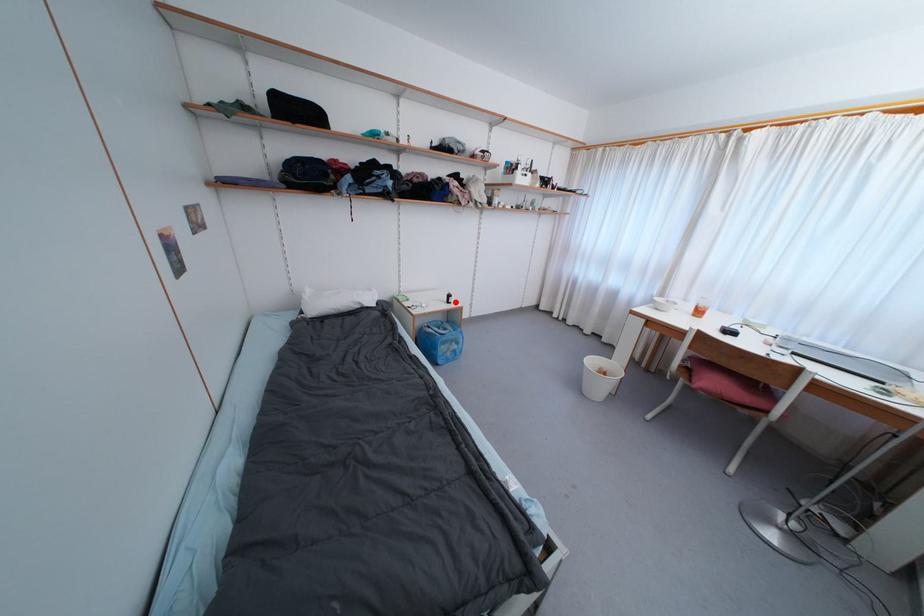
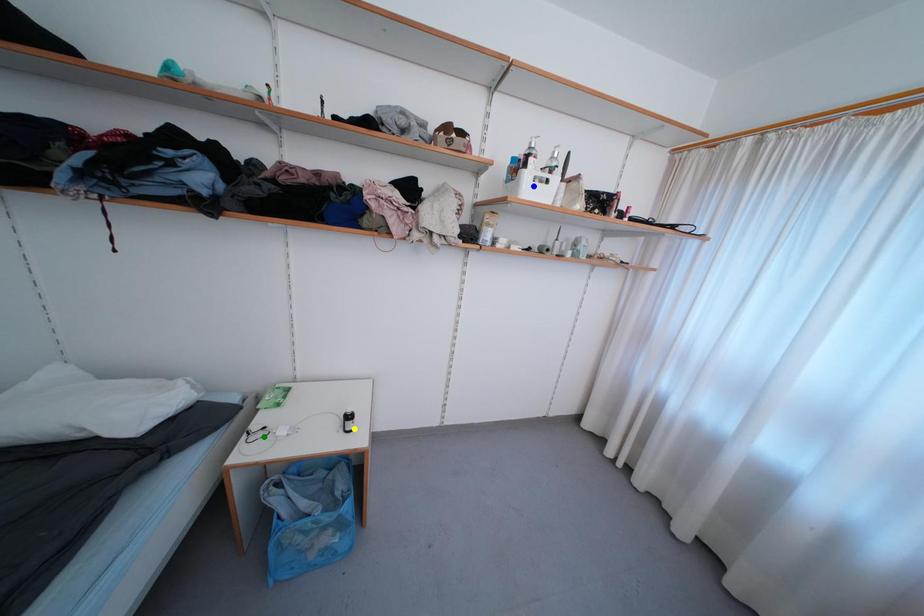
Question: I am providing you with two images of the same scene from different viewpoints. A red point is marked on the first image. You are given multiple points on the second image. Which point in image 2 is actually the same real-world point as the red point in image 1?

Choices:
 (A) blue point
 (B) green point
 (C) yellow point

Answer: (C)